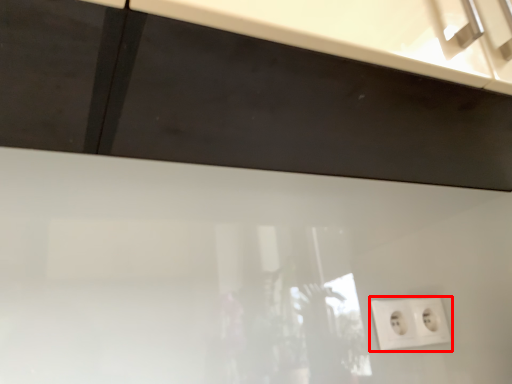
Question: From the image's perspective, what is the correct spatial positioning of power plugs and sockets (annotated by the red box) in reference to cabinetry?

Choices:
 (A) above
 (B) below

Answer: (B)